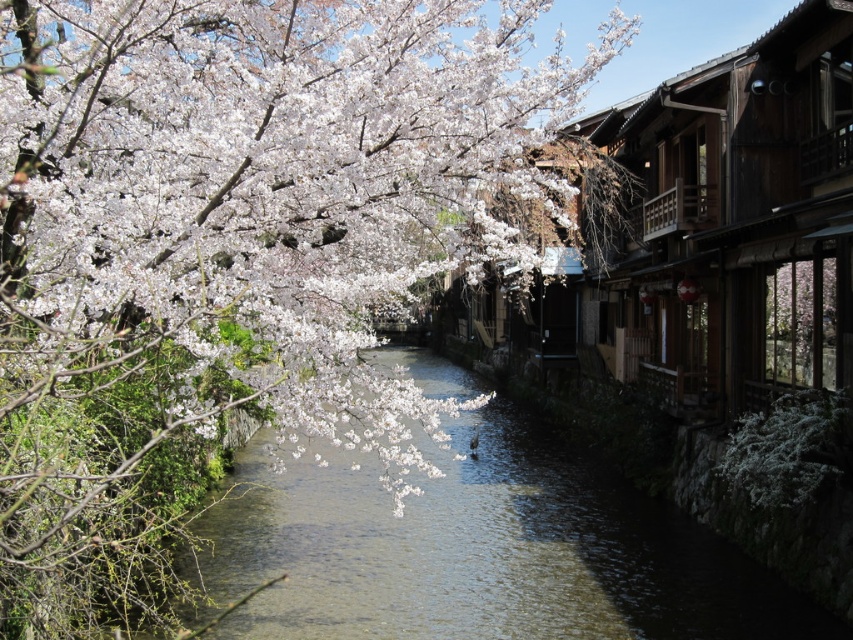
You are an artist planning to paint this scene. You want to highlight the white matte flower at upper left and the clear water at center. Which object should you paint first if you want to emphasize its size in relation to the other?

You should paint the white matte flower at upper left first because it has a larger size compared to the clear water at center, allowing you to establish its prominence in the composition.

You are standing on the bank of the canal and want to observe both the white matte flower at upper left and the clear water at center. Which object is higher in elevation?

The white matte flower at upper left is above clear water at center, so it is higher in elevation.